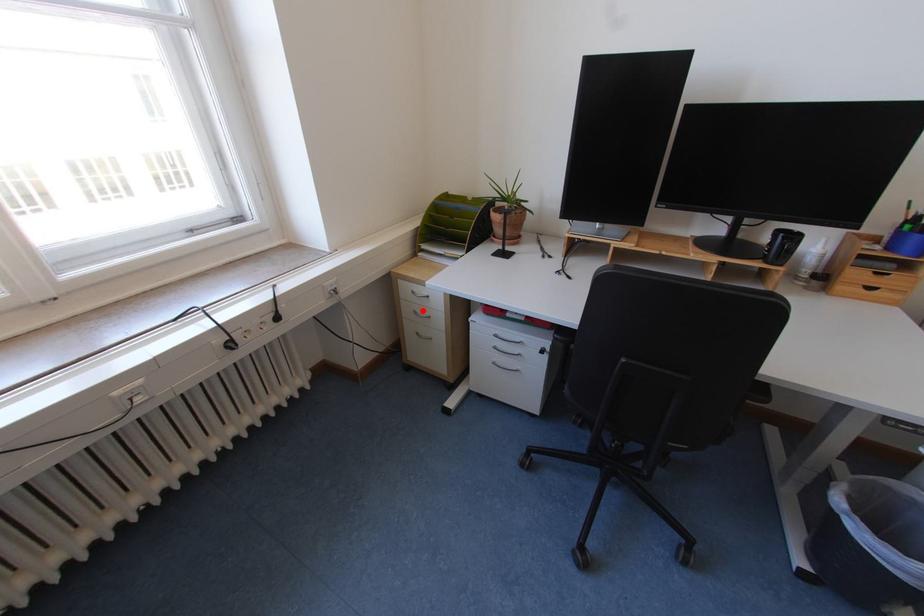
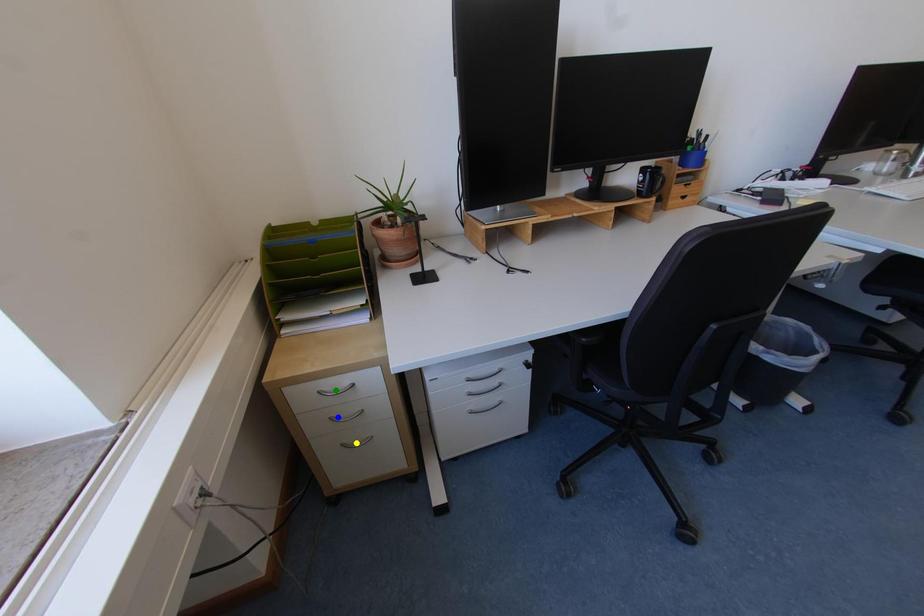
Question: I am providing you with two images of the same scene from different viewpoints. A red point is marked on the first image. You are given multiple points on the second image. Can you choose the point in image 2 that corresponds to the point in image 1?

Choices:
 (A) yellow point
 (B) green point
 (C) blue point

Answer: (C)